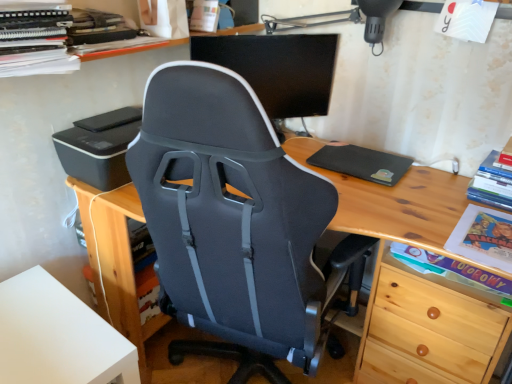
The height and width of the screenshot is (384, 512). In order to click on vacant space that is in between black matte/black rubberized mousepad at right and hardcover book at right, the second book from the bottom in this screenshot , I will do `click(438, 188)`.